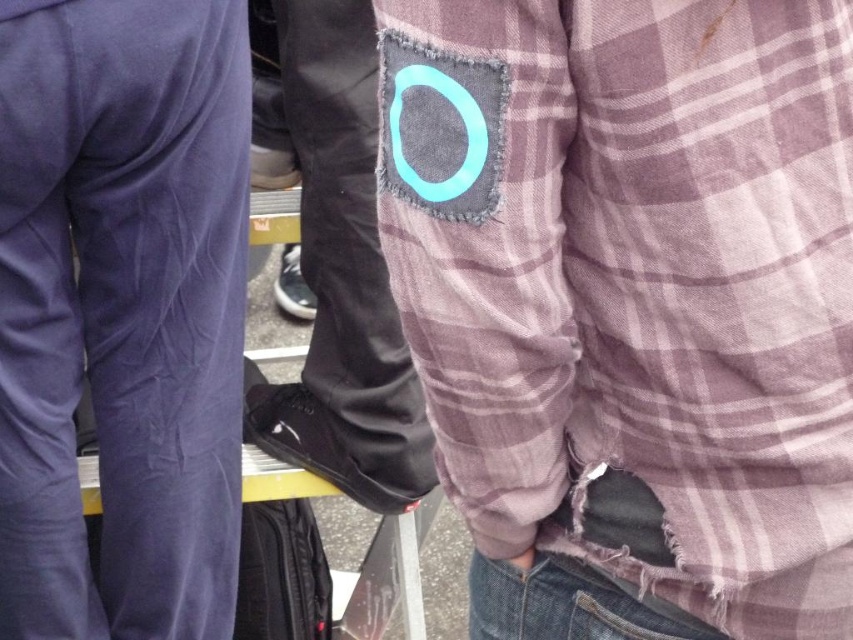
You are a fashion designer observing the scene. You need to decide which clothing item to recommend for a client who prefers larger sizes. Which one between the velvet purple pants at left and the denim at lower center would you suggest?

The velvet purple pants at left has a larger size compared to denim at lower center, so it would be the better recommendation for the client who prefers larger sizes.